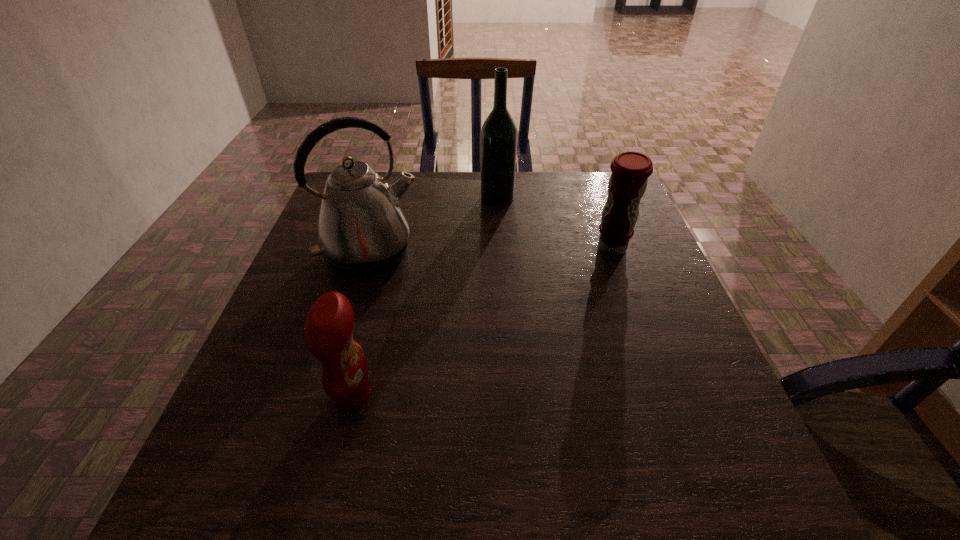
The image size is (960, 540). In order to click on free space between the right condiment and the left condiment in this screenshot , I will do `click(482, 322)`.

Image resolution: width=960 pixels, height=540 pixels. Identify the location of vacant area between the kettle and the right condiment. (x=491, y=251).

You are a GUI agent. You are given a task and a screenshot of the screen. Output one action in this format:
    pyautogui.click(x=<x>, y=<y>)
    Task: Click on the free space between the farther condiment and the nearer condiment
    The image size is (960, 540).
    Given the screenshot: What is the action you would take?
    pyautogui.click(x=482, y=322)

In order to click on vacant space that's between the kettle and the right condiment in this screenshot , I will do 491,251.

The width and height of the screenshot is (960, 540). Identify the location of vacant area that lies between the left condiment and the rightmost object. (482, 322).

Locate an element on the screen. The image size is (960, 540). free spot between the kettle and the right condiment is located at coordinates (491, 251).

Locate an element on the screen. The image size is (960, 540). vacant space that's between the farthest object and the nearest object is located at coordinates (425, 296).

Locate an element on the screen. Image resolution: width=960 pixels, height=540 pixels. free space that is in between the third object from left to right and the nearer condiment is located at coordinates (425, 296).

This screenshot has width=960, height=540. In order to click on vacant space in between the alcohol and the left condiment in this screenshot , I will do `click(425, 296)`.

Locate an element on the screen. unoccupied area between the kettle and the right condiment is located at coordinates (491, 251).